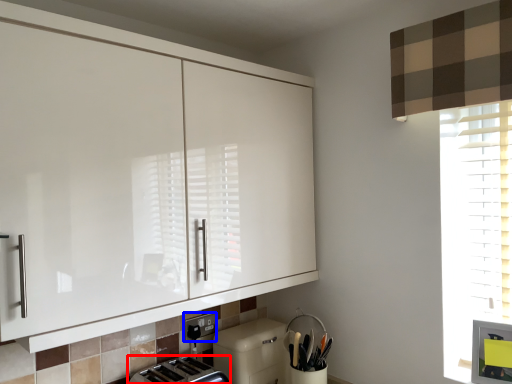
Question: Which of the following is the closest to the observer, toaster (highlighted by a red box) or electric outlet (highlighted by a blue box)?

Choices:
 (A) toaster
 (B) electric outlet

Answer: (A)